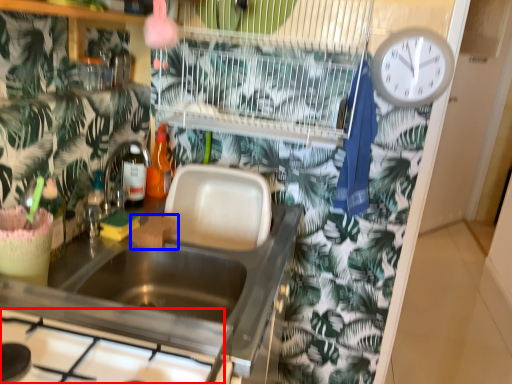
Question: Among these objects, which one is nearest to the camera, gas stove (highlighted by a red box) or food (highlighted by a blue box)?

Choices:
 (A) gas stove
 (B) food

Answer: (A)